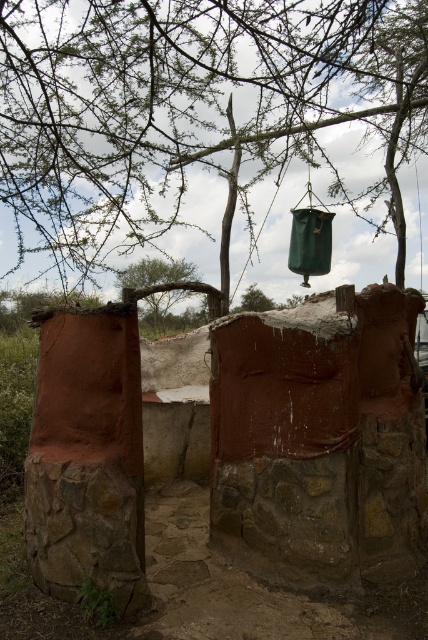
Question: Can you confirm if green matte hanging pot at upper center is wider than green leafy tree at center?

Choices:
 (A) yes
 (B) no

Answer: (A)

Question: Which object appears farthest from the camera in this image?

Choices:
 (A) green leafy tree at center
 (B) green matte hanging pot at upper center

Answer: (A)

Question: Considering the relative positions of green matte hanging pot at upper center and green leafy tree at center in the image provided, where is green matte hanging pot at upper center located with respect to green leafy tree at center?

Choices:
 (A) left
 (B) right

Answer: (B)

Question: Which point is farther to the camera?

Choices:
 (A) green leafy tree at center
 (B) green matte hanging pot at upper center

Answer: (A)

Question: Does green matte hanging pot at upper center appear on the right side of green leafy tree at center?

Choices:
 (A) yes
 (B) no

Answer: (A)